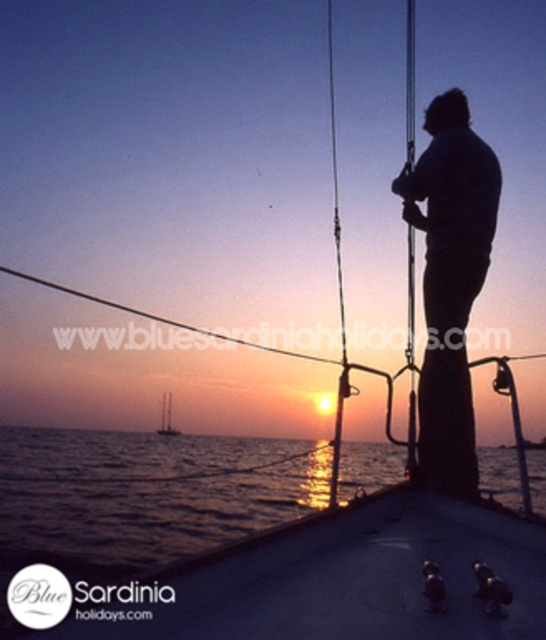
Question: Is smooth water at lower center above white matte sailboat at center?

Choices:
 (A) yes
 (B) no

Answer: (A)

Question: Does smooth water at lower center appear under black matte figure at center?

Choices:
 (A) no
 (B) yes

Answer: (B)

Question: Which of these objects is positioned closest to the smooth water at lower center?

Choices:
 (A) white matte sailboat at center
 (B) black matte figure at center

Answer: (A)

Question: Which object is closer to the camera taking this photo?

Choices:
 (A) white matte sailboat at center
 (B) smooth water at lower center

Answer: (B)

Question: Based on their relative distances, which object is nearer to the smooth water at lower center?

Choices:
 (A) black matte figure at center
 (B) white matte sailboat at center

Answer: (B)

Question: Does smooth water at lower center have a greater width compared to black matte figure at center?

Choices:
 (A) yes
 (B) no

Answer: (A)